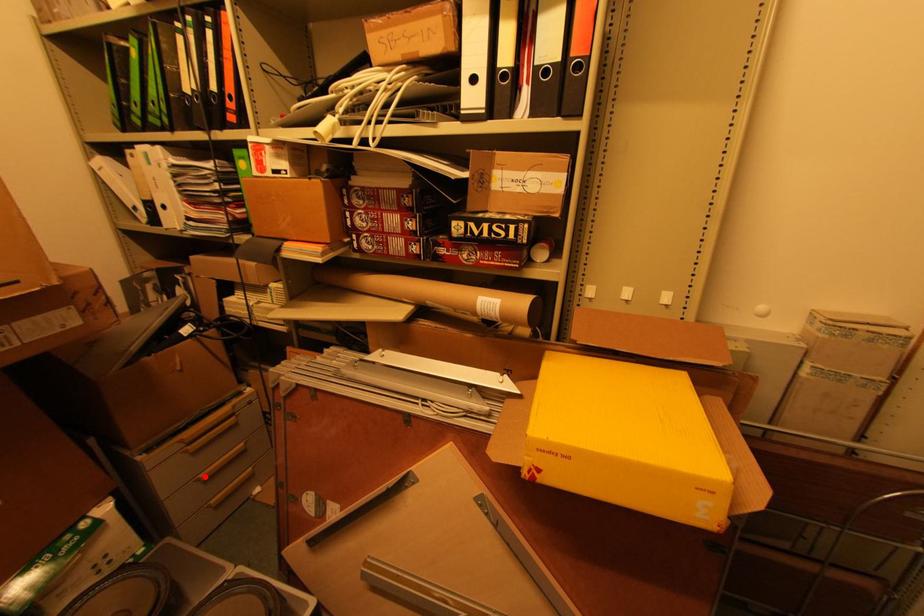
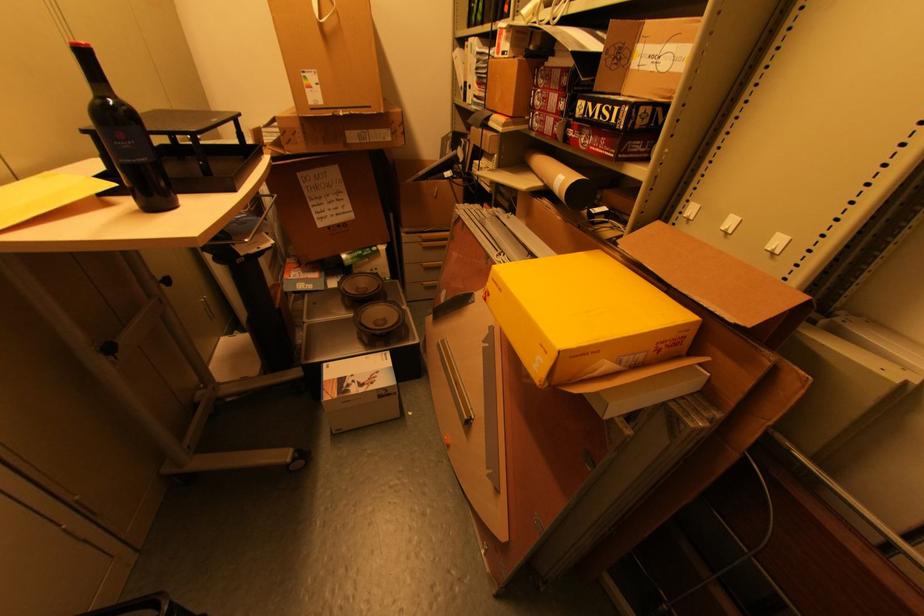
Question: I am providing you with two images of the same scene from different viewpoints. Image1 has a red point marked. In image2, the corresponding 3D location appears at what relative position? Reply with the corresponding letter.

Choices:
 (A) Closer
 (B) Farther

Answer: (A)